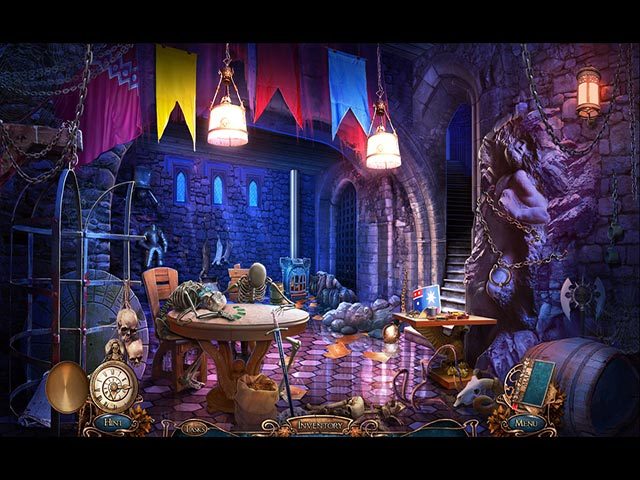
Locate an element on the screen. This screenshot has height=480, width=640. places to sit is located at coordinates (166, 287), (234, 275).